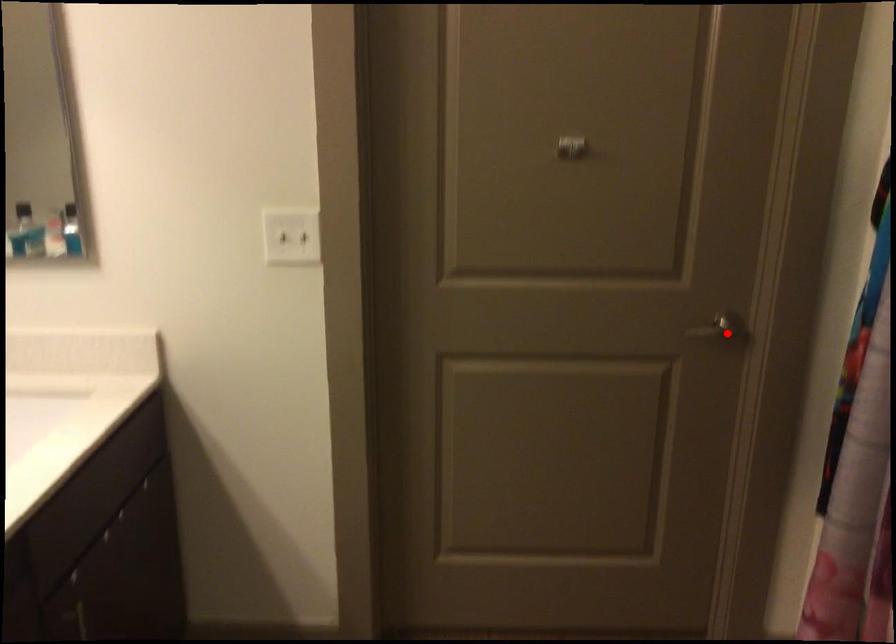
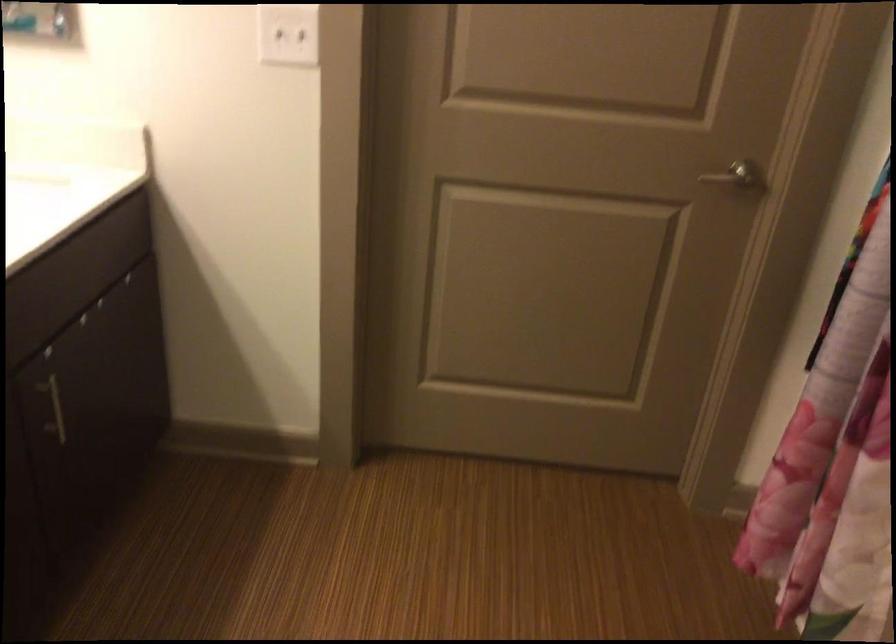
Where in the second image is the point corresponding to the highlighted location from the first image?

(739, 178)